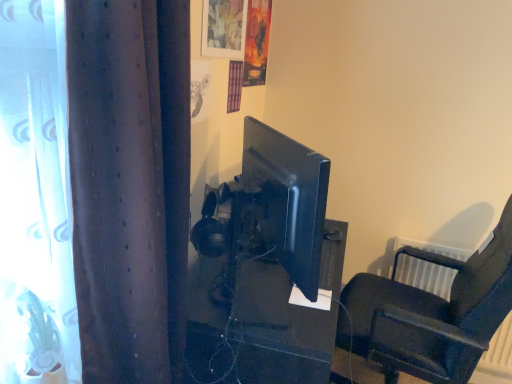
Question: Is the position of satin black monitor at center less distant than that of black leather chair at right?

Choices:
 (A) no
 (B) yes

Answer: (A)

Question: Does satin black monitor at center have a greater height compared to black leather chair at right?

Choices:
 (A) yes
 (B) no

Answer: (B)

Question: Does satin black monitor at center have a larger size compared to black leather chair at right?

Choices:
 (A) no
 (B) yes

Answer: (A)

Question: Is satin black monitor at center facing towards black leather chair at right?

Choices:
 (A) no
 (B) yes

Answer: (B)

Question: Can you confirm if satin black monitor at center is wider than black leather chair at right?

Choices:
 (A) no
 (B) yes

Answer: (A)

Question: Is satin black monitor at center positioned far away from black leather chair at right?

Choices:
 (A) yes
 (B) no

Answer: (B)

Question: From a real-world perspective, is matte plastic picture frame at upper center physically above black leather chair at right?

Choices:
 (A) yes
 (B) no

Answer: (A)

Question: Considering the relative sizes of matte plastic picture frame at upper center and black leather chair at right in the image provided, is matte plastic picture frame at upper center wider than black leather chair at right?

Choices:
 (A) yes
 (B) no

Answer: (B)

Question: Is matte plastic picture frame at upper center at the right side of black leather chair at right?

Choices:
 (A) no
 (B) yes

Answer: (A)

Question: From the image's perspective, is matte plastic picture frame at upper center over black leather chair at right?

Choices:
 (A) yes
 (B) no

Answer: (A)

Question: Is matte plastic picture frame at upper center looking in the opposite direction of black leather chair at right?

Choices:
 (A) no
 (B) yes

Answer: (A)

Question: Can you confirm if matte plastic picture frame at upper center is smaller than black leather chair at right?

Choices:
 (A) yes
 (B) no

Answer: (A)

Question: Is brown textured curtain at left at the right side of black leather chair at right?

Choices:
 (A) yes
 (B) no

Answer: (B)